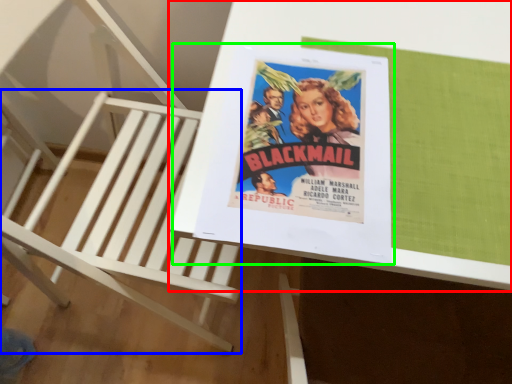
Question: Which is nearer to the table (highlighted by a red box)? furniture (highlighted by a blue box) or paperback book (highlighted by a green box).

Choices:
 (A) furniture
 (B) paperback book

Answer: (B)